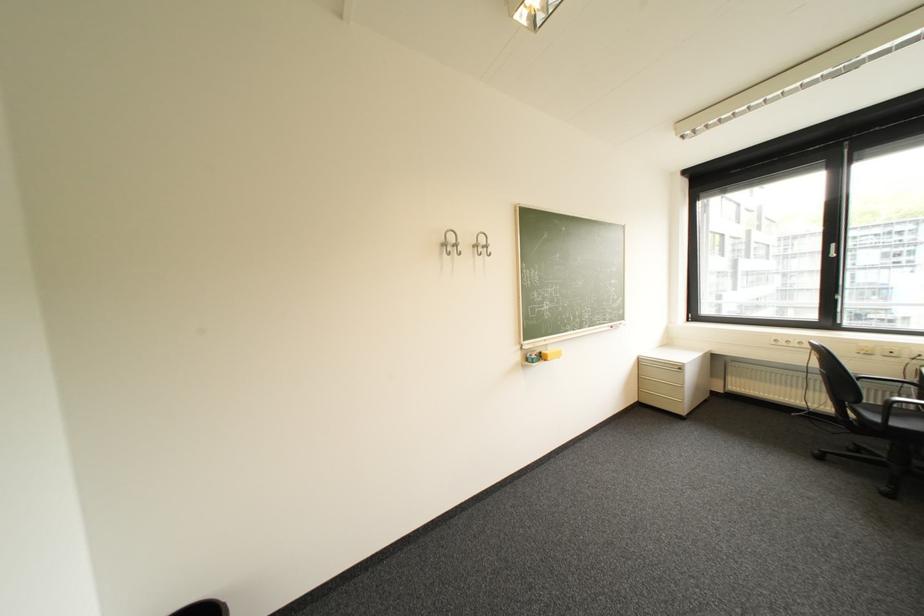
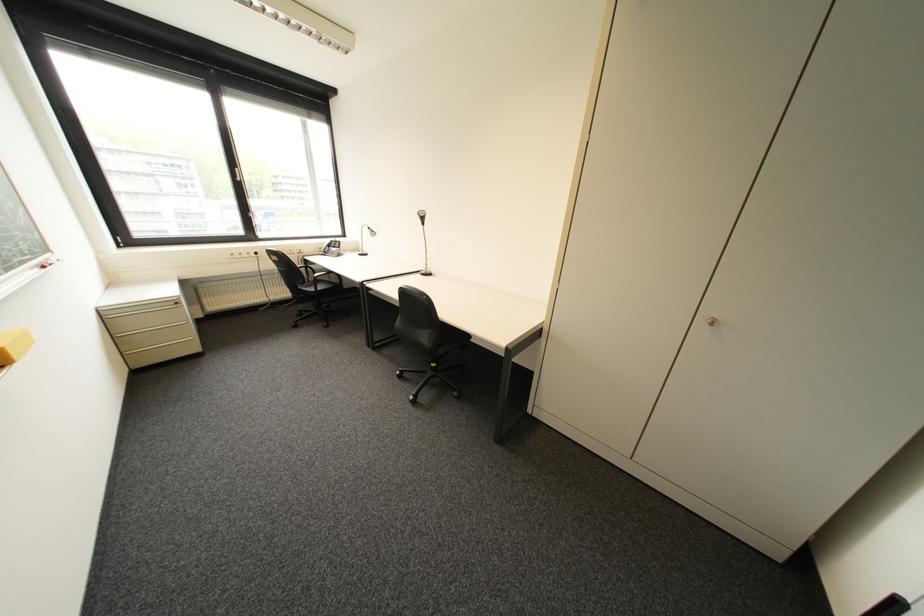
In the second image, find the point that corresponds to pixel 651 363 in the first image.

(119, 318)